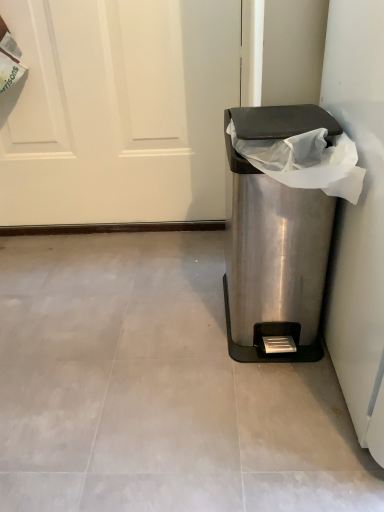
This screenshot has height=512, width=384. I want to click on blank space situated above satin silver trash can at right (from a real-world perspective), so click(294, 117).